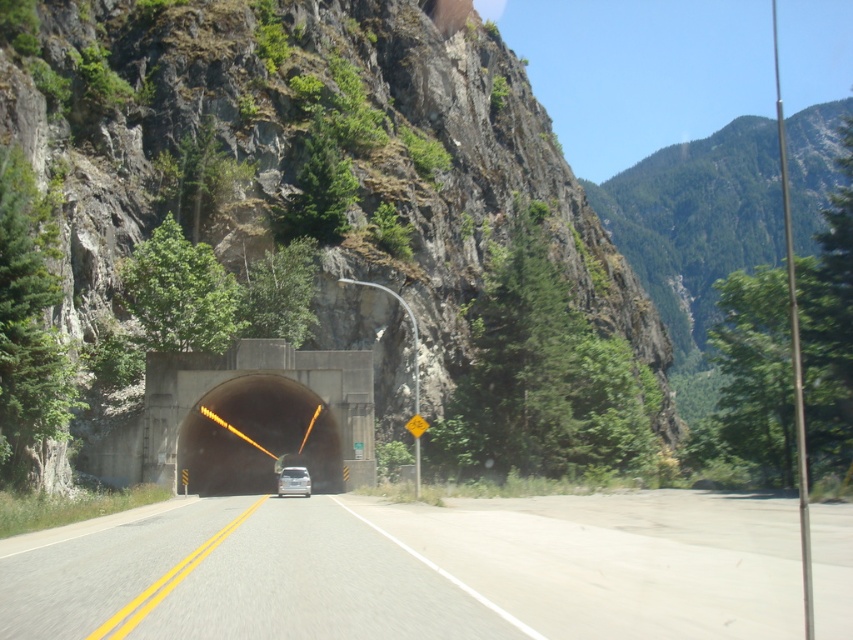
Question: Is black concrete tunnel at center positioned before silver metallic car at center?

Choices:
 (A) no
 (B) yes

Answer: (A)

Question: Which of the following is the farthest from the observer?

Choices:
 (A) asphalt road at center
 (B) silver metallic car at center
 (C) rocky gray mountain at center
 (D) black concrete tunnel at center

Answer: (D)

Question: Observing the image, what is the correct spatial positioning of asphalt road at center in reference to black concrete tunnel at center?

Choices:
 (A) left
 (B) right

Answer: (B)

Question: Does rocky gray mountain at center appear under asphalt road at center?

Choices:
 (A) yes
 (B) no

Answer: (B)

Question: Considering the real-world distances, which object is farthest from the silver metallic car at center?

Choices:
 (A) black concrete tunnel at center
 (B) asphalt road at center

Answer: (B)

Question: Which point is closer to the camera?

Choices:
 (A) asphalt road at center
 (B) rocky gray mountain at center

Answer: (A)